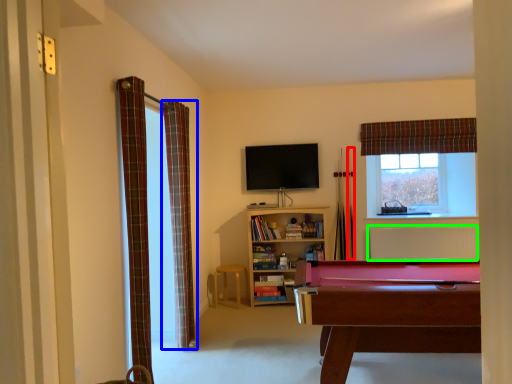
Question: Which is farther away from cue (highlighted by a red box)? curtain (highlighted by a blue box) or radiator (highlighted by a green box)?

Choices:
 (A) curtain
 (B) radiator

Answer: (A)